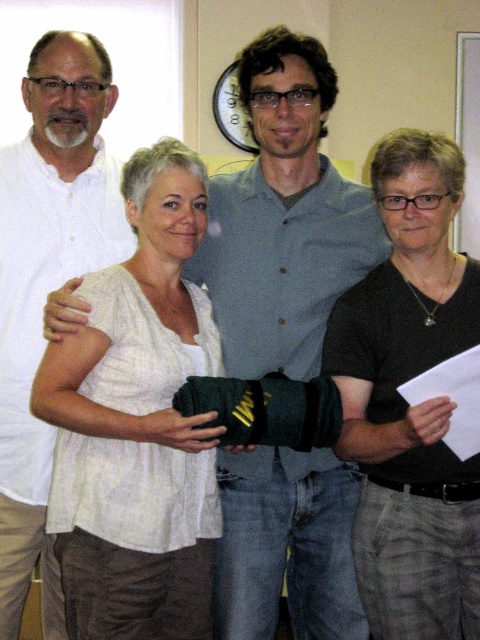
You are a photographer setting up a tripod to take a group photo. You notice the black matte shirt at right and the matte white board at upper right. Which object should you ensure is fully visible in the frame?

The black matte shirt at right is taller than the matte white board at upper right, so you should ensure the black matte shirt at right is fully visible in the frame to avoid it being cut off.

In the scene shown: You are organizing a community event and need to arrange a photo shoot. You have two items to place in the scene described above. The matte black shirt at center is worn by a participant, and the matte white board at upper right is part of the backdrop. Considering their sizes, which item takes up more horizontal space in the image?

The matte black shirt at center takes up more horizontal space in the image because its width surpasses that of the matte white board at upper right.

Based on the photo, you are a photographer trying to adjust the lighting for a group photo. You notice two shirts in the image, a black matte shirt at right and a white cotton shirt at left. Which shirt is positioned lower in the frame?

The black matte shirt at right is below the white cotton shirt at left, so it is positioned lower in the frame.